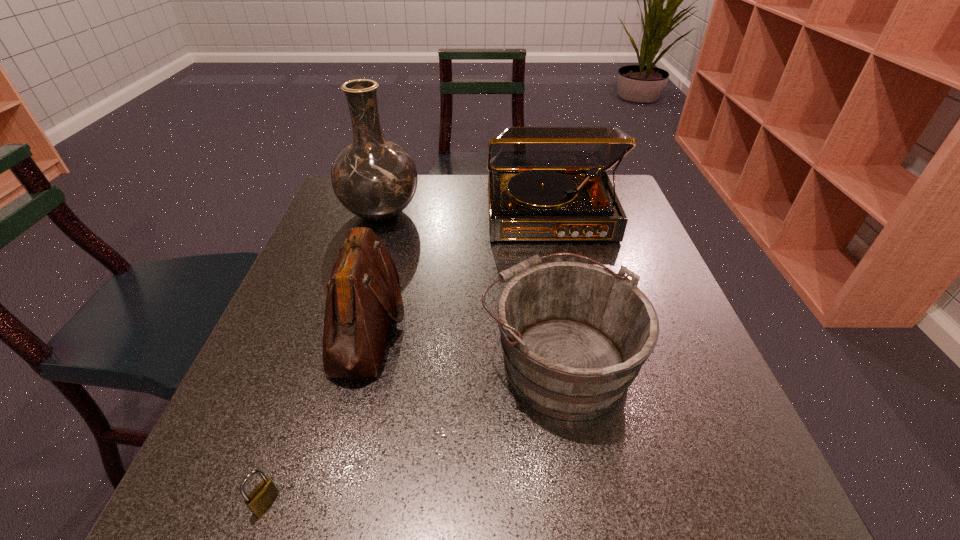
You are a GUI agent. You are given a task and a screenshot of the screen. Output one action in this format:
    pyautogui.click(x=<x>, y=<y>)
    Task: Click on the vase
    The image size is (960, 540).
    Given the screenshot: What is the action you would take?
    pos(376,179)

Where is `the second tallest object`? This screenshot has height=540, width=960. the second tallest object is located at coordinates (545, 183).

The height and width of the screenshot is (540, 960). I want to click on the third tallest object, so click(x=363, y=292).

Image resolution: width=960 pixels, height=540 pixels. Find the location of `wine bucket`. wine bucket is located at coordinates [x=574, y=336].

Locate an element on the screen. The image size is (960, 540). the shortest object is located at coordinates (264, 494).

At what (x,y) coordinates should I click in order to perform the action: click on the nearest object. Please return your answer as a coordinate pair (x, y). Looking at the image, I should click on pyautogui.click(x=264, y=494).

Where is `vacant point located 0.300m on the front of the vase`? vacant point located 0.300m on the front of the vase is located at coordinates (347, 325).

Locate an element on the screen. The height and width of the screenshot is (540, 960). vacant space positioned 0.070m on the front-facing side of the record player is located at coordinates (561, 265).

Where is `vacant space situated 0.070m on the left of the third tallest object`? The image size is (960, 540). vacant space situated 0.070m on the left of the third tallest object is located at coordinates (297, 325).

You are a GUI agent. You are given a task and a screenshot of the screen. Output one action in this format:
    pyautogui.click(x=<x>, y=<y>)
    Task: Click on the free region located on the back of the wine bucket
    This screenshot has width=960, height=540.
    Given the screenshot: What is the action you would take?
    pyautogui.click(x=538, y=238)